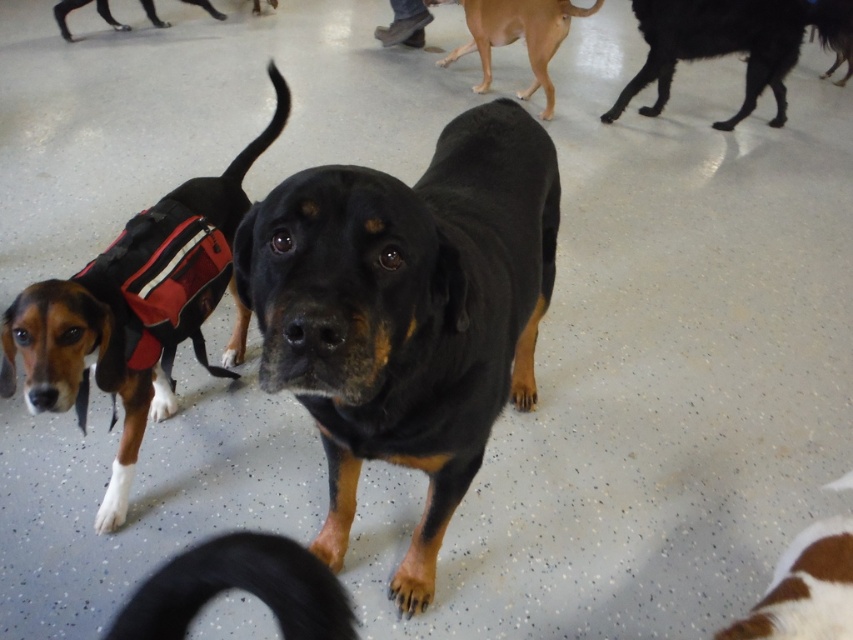
Question: Estimate the real-world distances between objects in this image. Which object is farther from the black fur dog at upper right?

Choices:
 (A) brown/black fur dog at left
 (B) black smooth dog at upper left
 (C) brown matte dog at upper center

Answer: (B)

Question: Does black smooth dog at center appear on the right side of brown/black fur dog at left?

Choices:
 (A) yes
 (B) no

Answer: (A)

Question: Which is farther from the black smooth dog at center?

Choices:
 (A) black fur dog at upper right
 (B) black smooth dog at upper left

Answer: (B)

Question: Is the position of black smooth dog at center more distant than that of brown matte dog at upper center?

Choices:
 (A) no
 (B) yes

Answer: (A)

Question: Can you confirm if black fur dog at upper right is positioned to the left of black smooth dog at upper left?

Choices:
 (A) yes
 (B) no

Answer: (B)

Question: Which of the following is the farthest from the observer?

Choices:
 (A) (4, 330)
 (B) (480, 4)
 (C) (750, 35)
 (D) (520, 109)

Answer: (B)